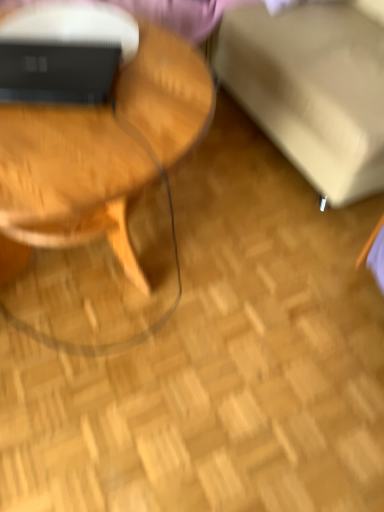
Question: From a real-world perspective, is matte black laptop at upper left physically below beige fabric swivel chair at upper right?

Choices:
 (A) yes
 (B) no

Answer: (B)

Question: Can you confirm if matte black laptop at upper left is wider than beige fabric swivel chair at upper right?

Choices:
 (A) no
 (B) yes

Answer: (A)

Question: Would you say matte black laptop at upper left is outside beige fabric swivel chair at upper right?

Choices:
 (A) no
 (B) yes

Answer: (B)

Question: Considering the relative positions of matte black laptop at upper left and beige fabric swivel chair at upper right in the image provided, is matte black laptop at upper left to the left of beige fabric swivel chair at upper right from the viewer's perspective?

Choices:
 (A) yes
 (B) no

Answer: (A)

Question: From the image's perspective, does matte black laptop at upper left appear lower than beige fabric swivel chair at upper right?

Choices:
 (A) yes
 (B) no

Answer: (A)

Question: Can you confirm if matte black laptop at upper left is positioned to the right of beige fabric swivel chair at upper right?

Choices:
 (A) yes
 (B) no

Answer: (B)

Question: Considering the relative sizes of woodenmaterial/texturecoffee table at left and beige fabric swivel chair at upper right in the image provided, is woodenmaterial/texturecoffee table at left thinner than beige fabric swivel chair at upper right?

Choices:
 (A) no
 (B) yes

Answer: (B)

Question: Is woodenmaterial/texturecoffee table at left aimed at beige fabric swivel chair at upper right?

Choices:
 (A) no
 (B) yes

Answer: (A)

Question: Is woodenmaterial/texturecoffee table at left outside beige fabric swivel chair at upper right?

Choices:
 (A) no
 (B) yes

Answer: (B)

Question: From the image's perspective, would you say woodenmaterial/texturecoffee table at left is shown under beige fabric swivel chair at upper right?

Choices:
 (A) yes
 (B) no

Answer: (A)

Question: Is woodenmaterial/texturecoffee table at left bigger than beige fabric swivel chair at upper right?

Choices:
 (A) no
 (B) yes

Answer: (A)

Question: Does woodenmaterial/texturecoffee table at left have a greater height compared to beige fabric swivel chair at upper right?

Choices:
 (A) no
 (B) yes

Answer: (B)

Question: Considering the relative sizes of woodenmaterial/texturecoffee table at left and matte black laptop at upper left in the image provided, is woodenmaterial/texturecoffee table at left taller than matte black laptop at upper left?

Choices:
 (A) yes
 (B) no

Answer: (A)